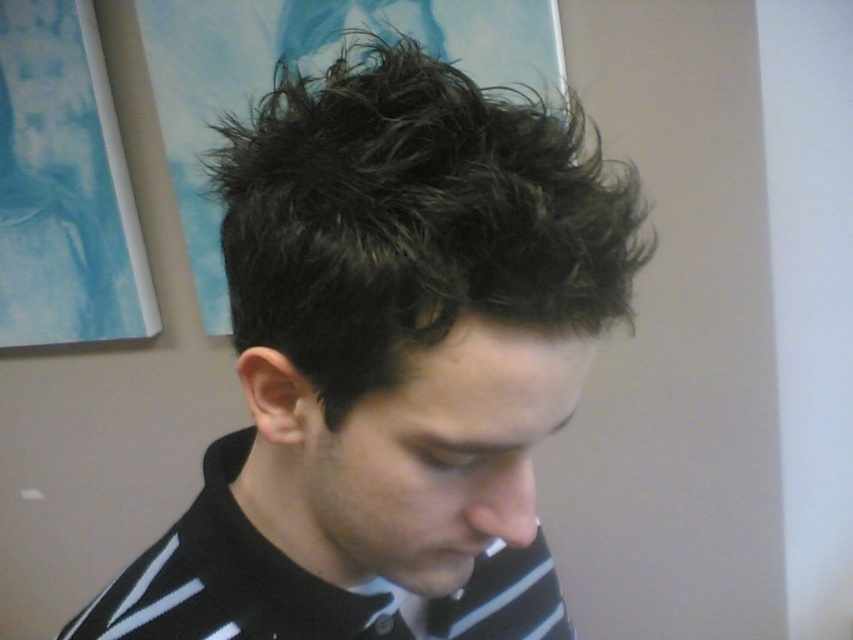
Question: Which of the following is the closest to the observer?

Choices:
 (A) (231, 572)
 (B) (467, 545)
 (C) (540, 534)

Answer: (B)

Question: Considering the relative positions of black striped shirt at center and matte black mouth at lower center in the image provided, where is black striped shirt at center located with respect to matte black mouth at lower center?

Choices:
 (A) below
 (B) above

Answer: (A)

Question: Which of these objects is positioned closest to the matte black mouth at lower center?

Choices:
 (A) black striped shirt at center
 (B) dark brown hair at center

Answer: (B)

Question: Which of the following is the closest to the observer?

Choices:
 (A) (556, 588)
 (B) (445, 544)

Answer: (B)

Question: Does dark brown hair at center have a greater width compared to black striped shirt at center?

Choices:
 (A) no
 (B) yes

Answer: (B)

Question: Is dark brown hair at center wider than matte black mouth at lower center?

Choices:
 (A) no
 (B) yes

Answer: (B)